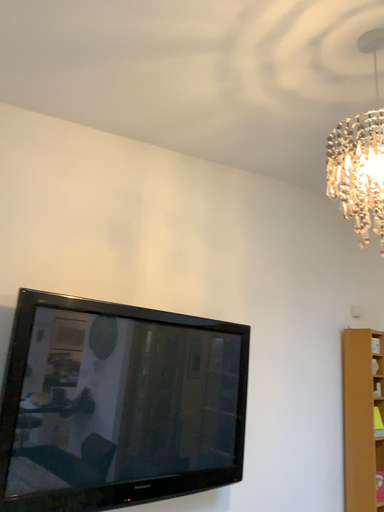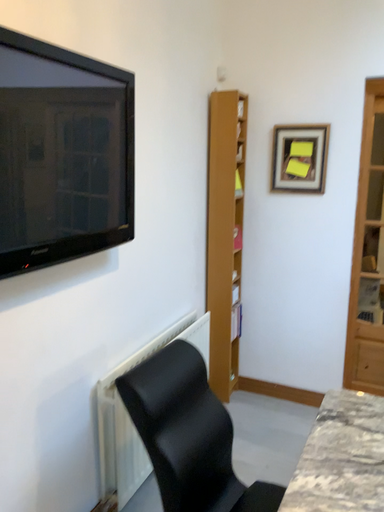
Question: How did the camera likely rotate when shooting the video?

Choices:
 (A) rotated upward
 (B) rotated downward

Answer: (B)